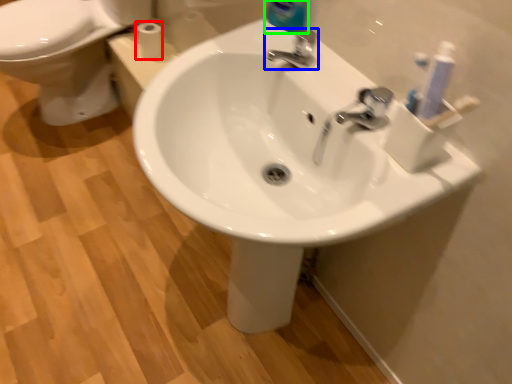
Question: Which is nearer to the toilet paper (highlighted by a red box)? tap (highlighted by a blue box) or cleaning product (highlighted by a green box).

Choices:
 (A) tap
 (B) cleaning product

Answer: (B)